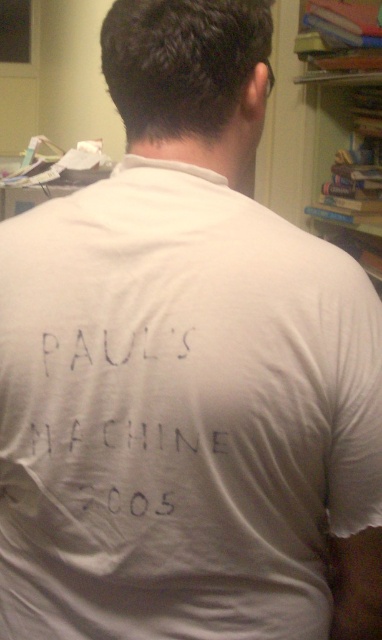
Question: Is white fabric text at back above wooden bookshelf at upper right?

Choices:
 (A) yes
 (B) no

Answer: (B)

Question: Can you confirm if white fabric text at back is smaller than wooden bookshelf at upper right?

Choices:
 (A) no
 (B) yes

Answer: (B)

Question: Which point is farther from the camera taking this photo?

Choices:
 (A) (158, 404)
 (B) (333, 113)

Answer: (B)

Question: Can you confirm if white fabric text at back is positioned below wooden bookshelf at upper right?

Choices:
 (A) no
 (B) yes

Answer: (B)